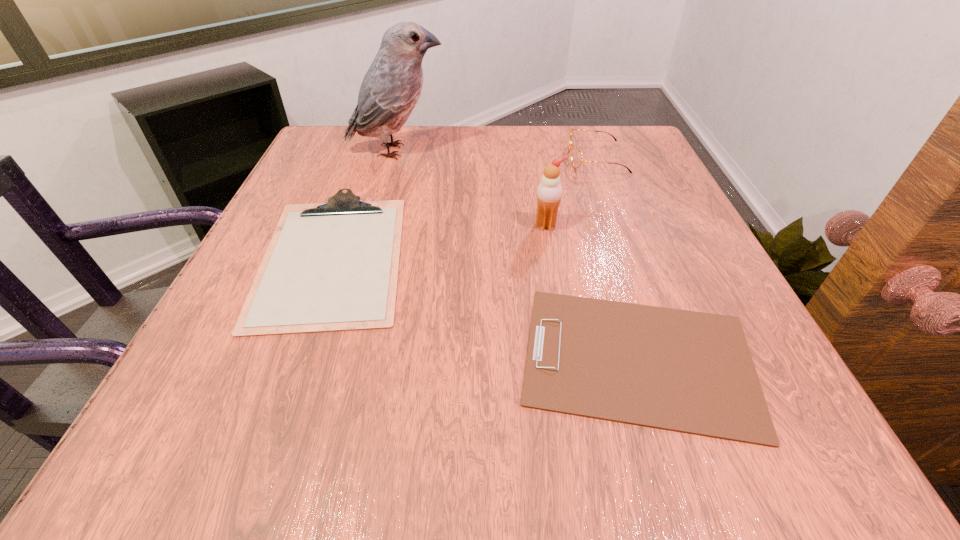
The image size is (960, 540). In order to click on the tallest object in this screenshot , I will do `click(391, 87)`.

Find the location of a particular element. the fourth shortest object is located at coordinates coord(549,192).

The image size is (960, 540). Find the location of `spectacles`. spectacles is located at coordinates (576, 156).

I want to click on the taller clipboard, so click(329, 267).

What are the coordinates of `the second shortest object` in the screenshot? It's located at (329, 267).

You are a GUI agent. You are given a task and a screenshot of the screen. Output one action in this format:
    pyautogui.click(x=<x>, y=<y>)
    Task: Click on the shorter clipboard
    
    Given the screenshot: What is the action you would take?
    pyautogui.click(x=692, y=372)

Find the location of a particular element. Image resolution: width=960 pixels, height=540 pixels. the right clipboard is located at coordinates click(692, 372).

At what (x,y) coordinates should I click in order to perform the action: click on vacant space situated on the front-facing side of the tallest object. Please return your answer as a coordinate pair (x, y). Looking at the image, I should click on (497, 151).

This screenshot has height=540, width=960. What are the coordinates of `free space located at the front with a straw on the second tallest object` in the screenshot? It's located at (551, 256).

The height and width of the screenshot is (540, 960). Find the location of `vacant position located on the front-facing side of the spectacles`. vacant position located on the front-facing side of the spectacles is located at coordinates (485, 158).